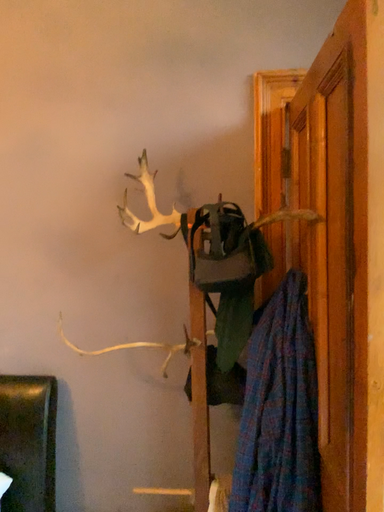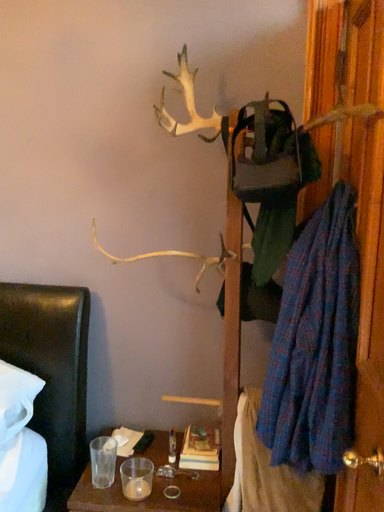
Question: Which way did the camera rotate in the video?

Choices:
 (A) rotated downward
 (B) rotated upward

Answer: (A)